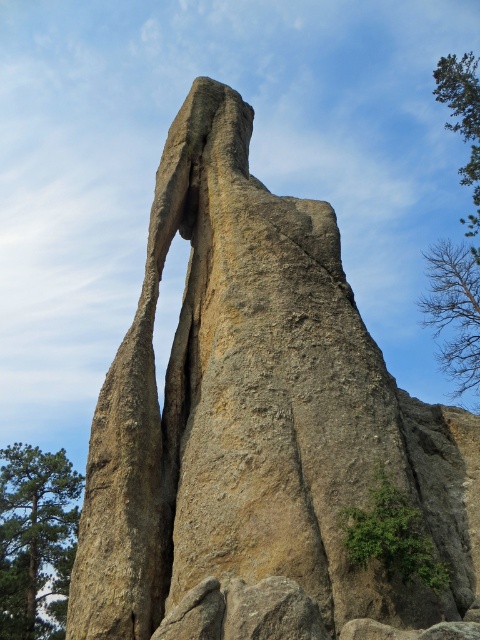
Question: Which object is the closest to the green leafy tree at upper right?

Choices:
 (A) green leafy tree at left
 (B) green leafy tree at lower right

Answer: (A)

Question: Is green leafy tree at lower right closer to camera compared to green leafy tree at upper right?

Choices:
 (A) yes
 (B) no

Answer: (A)

Question: Observing the image, what is the correct spatial positioning of green leafy tree at lower right in reference to green leafy tree at upper right?

Choices:
 (A) left
 (B) right

Answer: (A)

Question: Considering the relative positions of bare branches at upper right and green leafy tree at upper right in the image provided, where is bare branches at upper right located with respect to green leafy tree at upper right?

Choices:
 (A) left
 (B) right

Answer: (A)

Question: Based on their relative distances, which object is farther from the green leafy tree at left?

Choices:
 (A) green leafy tree at upper right
 (B) bare branches at upper right

Answer: (A)

Question: Among these objects, which one is nearest to the camera?

Choices:
 (A) bare branches at upper right
 (B) green leafy tree at lower right
 (C) green leafy tree at left
 (D) green leafy tree at upper right

Answer: (B)